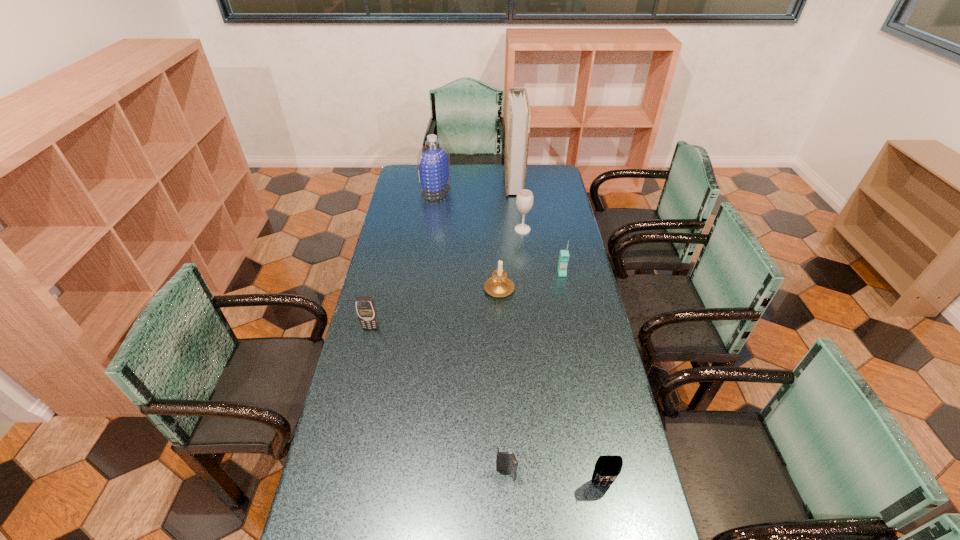
This screenshot has width=960, height=540. Find the location of `the second cellular telephone from left to right`. the second cellular telephone from left to right is located at coordinates (504, 461).

Locate an element on the screen. vacant space located 0.140m on the cover of the phonebook is located at coordinates tap(479, 182).

Where is `blank space located on the cover of the phonebook`? The height and width of the screenshot is (540, 960). blank space located on the cover of the phonebook is located at coordinates (484, 182).

At what (x,y) coordinates should I click in order to perform the action: click on free location located on the cover of the phonebook. Please return your answer as a coordinate pair (x, y). The image size is (960, 540). Looking at the image, I should click on pyautogui.click(x=486, y=182).

At what (x,y) coordinates should I click in order to perform the action: click on blank space located on the right of the second object from left to right. Please return your answer as a coordinate pair (x, y). The image size is (960, 540). Looking at the image, I should click on (476, 191).

Identify the location of free space located on the back of the wineglass. This screenshot has height=540, width=960. coord(518,192).

The image size is (960, 540). In order to click on free point located 0.140m on the keypad of the farthest cellular telephone in this screenshot , I will do `click(567, 302)`.

The height and width of the screenshot is (540, 960). I want to click on vacant space situated 0.160m on the front face of the leftmost object, so click(x=362, y=367).

Locate an element on the screen. The image size is (960, 540). free space located with a handle on the side of the candle holder is located at coordinates (497, 251).

Find the location of a particular element. The height and width of the screenshot is (540, 960). vacant space located 0.270m with a handle on the side of the candle holder is located at coordinates (496, 235).